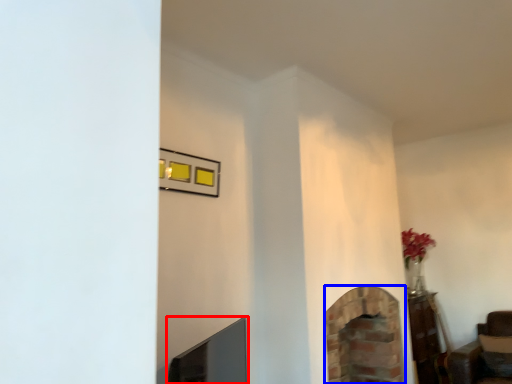
Question: Which of the following is the farthest to the observer, fireplace (highlighted by a red box) or fireplace (highlighted by a blue box)?

Choices:
 (A) fireplace
 (B) fireplace

Answer: (B)